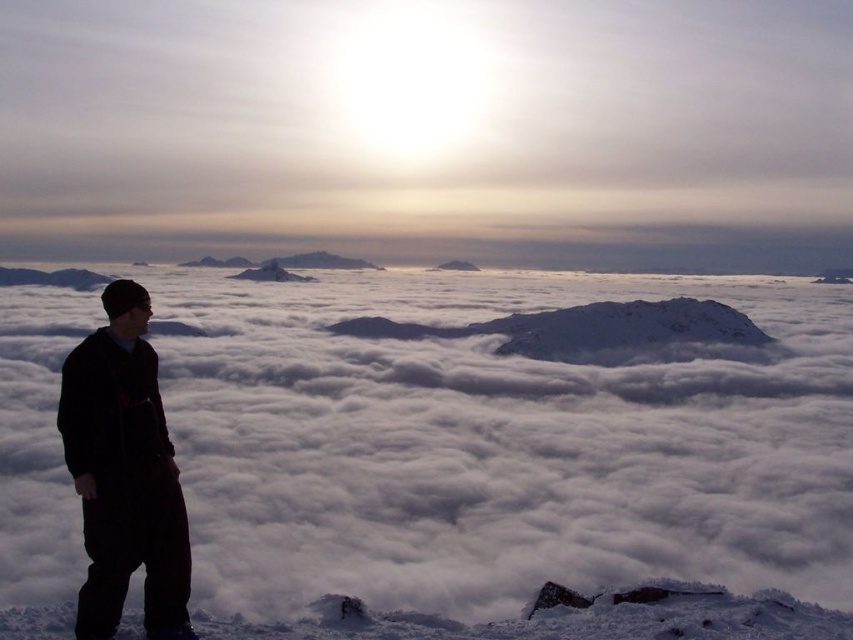
Question: Estimate the real-world distances between objects in this image. Which object is farther from the white fluffy cloud at upper center?

Choices:
 (A) dark gray fleece jacket at left
 (B) white matte snow at left

Answer: (A)

Question: Considering the relative positions of white matte snow at left and dark gray fleece jacket at left in the image provided, where is white matte snow at left located with respect to dark gray fleece jacket at left?

Choices:
 (A) right
 (B) left

Answer: (A)

Question: Which object appears closest to the camera in this image?

Choices:
 (A) white fluffy cloud at upper center
 (B) white matte snow at left

Answer: (B)

Question: Is white matte snow at left positioned at the back of white fluffy cloud at upper center?

Choices:
 (A) yes
 (B) no

Answer: (B)

Question: Is white matte snow at left further to camera compared to white fluffy cloud at upper center?

Choices:
 (A) no
 (B) yes

Answer: (A)

Question: Estimate the real-world distances between objects in this image. Which object is closer to the dark gray fleece jacket at left?

Choices:
 (A) white matte snow at left
 (B) white fluffy cloud at upper center

Answer: (A)